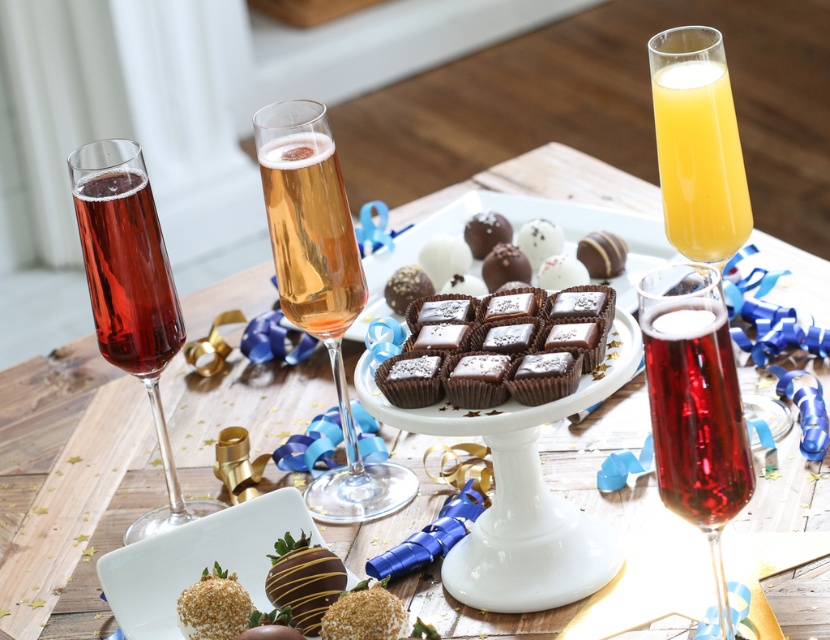
Can you confirm if matte glass wine at left is positioned to the left of translucent glass orange juice at upper right?

Correct, you'll find matte glass wine at left to the left of translucent glass orange juice at upper right.

Can you confirm if matte glass wine at left is smaller than translucent glass orange juice at upper right?

No, matte glass wine at left is not smaller than translucent glass orange juice at upper right.

This screenshot has width=830, height=640. I want to click on matte glass wine at left, so click(130, 292).

From the picture: Can you confirm if matte glass at left is positioned above chocolate-coated truffle at center?

Actually, matte glass at left is below chocolate-coated truffle at center.

This screenshot has height=640, width=830. Describe the element at coordinates (127, 272) in the screenshot. I see `matte glass at left` at that location.

This screenshot has width=830, height=640. In order to click on matte glass at left in this screenshot , I will do click(x=127, y=272).

Find the location of `matte glass at left`. matte glass at left is located at coordinates (127, 272).

Who is more forward, [264,198] or [134,166]?

Positioned in front is point [134,166].

Can you confirm if translucent glass champagne flute at center is smaller than matte glass wine at left?

No.

Is point (284, 268) positioned after point (89, 195)?

That is True.

Image resolution: width=830 pixels, height=640 pixels. What are the coordinates of `translucent glass champagne flute at center` in the screenshot? It's located at (321, 288).